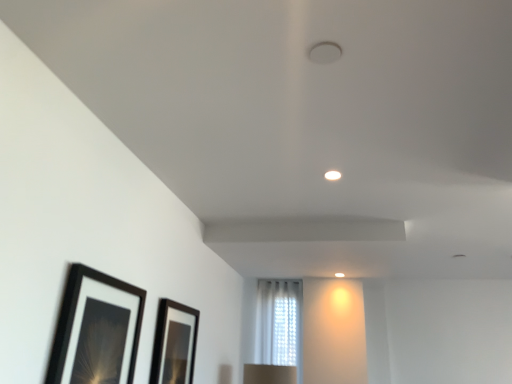
Question: Does black matte picture frame at lower left, positioned as the first picture frame in left-to-right order, have a larger size compared to white sheer curtain at center?

Choices:
 (A) no
 (B) yes

Answer: (A)

Question: Is black matte picture frame at lower left, which ranks as the second picture frame in back-to-front order, not inside white sheer curtain at center?

Choices:
 (A) no
 (B) yes

Answer: (B)

Question: Considering the relative sizes of black matte picture frame at lower left, positioned as the first picture frame in left-to-right order, and white sheer curtain at center in the image provided, is black matte picture frame at lower left, positioned as the first picture frame in left-to-right order, taller than white sheer curtain at center?

Choices:
 (A) yes
 (B) no

Answer: (B)

Question: From the image's perspective, is black matte picture frame at lower left, which is counted as the first picture frame, starting from the front, located beneath white sheer curtain at center?

Choices:
 (A) yes
 (B) no

Answer: (B)

Question: From a real-world perspective, is black matte picture frame at lower left, which is counted as the first picture frame, starting from the front, physically above white sheer curtain at center?

Choices:
 (A) no
 (B) yes

Answer: (A)

Question: Is white sheer curtain at center in front of or behind black glossy picture frame at lower center, which is the second picture frame in left-to-right order, in the image?

Choices:
 (A) front
 (B) behind

Answer: (B)

Question: From a real-world perspective, relative to black glossy picture frame at lower center, arranged as the second picture frame when viewed from the front, is white sheer curtain at center vertically above or below?

Choices:
 (A) above
 (B) below

Answer: (A)

Question: Is white sheer curtain at center inside or outside of black glossy picture frame at lower center, the 1th picture frame positioned from the right?

Choices:
 (A) inside
 (B) outside

Answer: (B)

Question: Is white sheer curtain at center wider or thinner than black glossy picture frame at lower center, the 1th picture frame positioned from the right?

Choices:
 (A) thin
 (B) wide

Answer: (B)

Question: Do you think black matte picture frame at lower left, placed as the 2th picture frame when sorted from right to left, is within black glossy picture frame at lower center, which ranks as the 1th picture frame in back-to-front order, or outside of it?

Choices:
 (A) inside
 (B) outside

Answer: (B)

Question: Based on their sizes in the image, would you say black matte picture frame at lower left, which ranks as the second picture frame in back-to-front order, is bigger or smaller than black glossy picture frame at lower center, arranged as the second picture frame when viewed from the front?

Choices:
 (A) big
 (B) small

Answer: (A)

Question: From a real-world perspective, is black matte picture frame at lower left, which ranks as the second picture frame in back-to-front order, positioned above or below black glossy picture frame at lower center, which is the second picture frame in left-to-right order?

Choices:
 (A) below
 (B) above

Answer: (B)

Question: Is point (53, 372) closer or farther from the camera than point (159, 365)?

Choices:
 (A) closer
 (B) farther

Answer: (A)

Question: In terms of width, does white sheer curtain at center look wider or thinner when compared to black matte picture frame at lower left, which ranks as the second picture frame in back-to-front order?

Choices:
 (A) thin
 (B) wide

Answer: (B)

Question: In terms of height, does white sheer curtain at center look taller or shorter compared to black matte picture frame at lower left, which ranks as the second picture frame in back-to-front order?

Choices:
 (A) tall
 (B) short

Answer: (A)